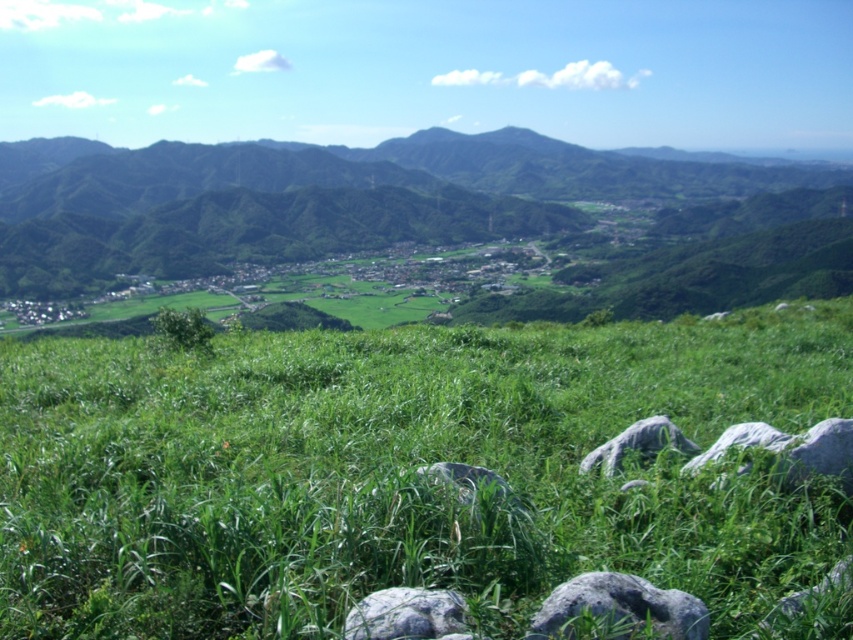
Consider the image. You are standing on the gray rough rock at lower center and want to climb to the top of the green grassy hill at center. Based on the scene description, will you need to climb upwards or downwards?

The green grassy hill at center has a greater height compared to the gray rough rock at lower center, so you will need to climb upwards to reach the top of the green grassy hill at center.

You are a hiker standing at the gray rough stone at lower center in the image. You want to reach the green grassy hill at center. Based on the distance between them, can you estimate how long it would take you to walk there at a normal pace?

The green grassy hill at center and gray rough stone at lower center are 93.74 meters apart. At a normal walking pace of approximately 1.4 meters per second, it would take roughly 67 seconds, or about 1 minute and 7 seconds, to reach the hill.